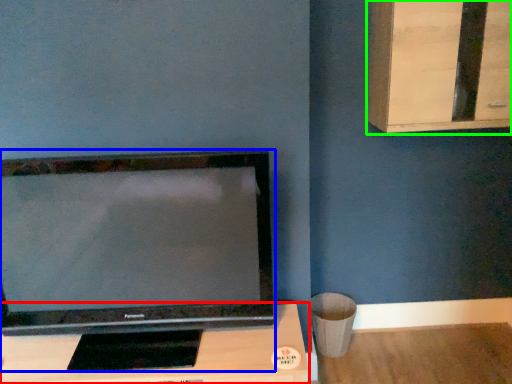
Question: Based on their relative distances, which object is farther from furniture (highlighted by a red box)? Choose from television (highlighted by a blue box) and dresser (highlighted by a green box).

Choices:
 (A) television
 (B) dresser

Answer: (B)